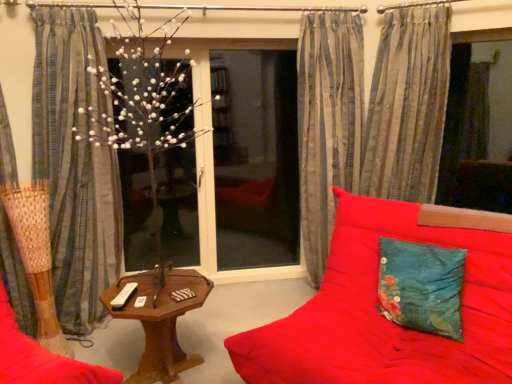
Where is `free space above transparent glass screen door at center (from a real-world perspective)`? This screenshot has height=384, width=512. free space above transparent glass screen door at center (from a real-world perspective) is located at coordinates (259, 41).